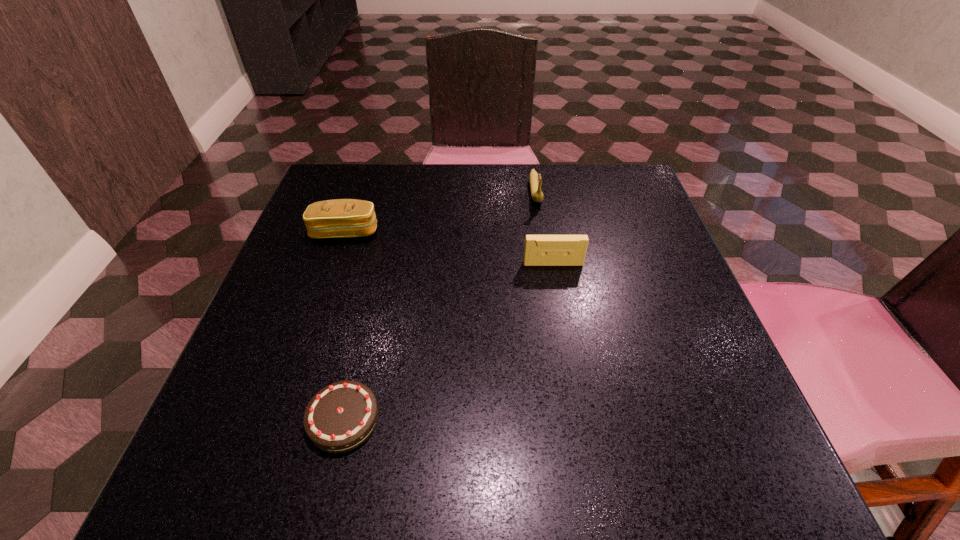
Find the location of a particular element. The height and width of the screenshot is (540, 960). free spot between the clutch bag and the farthest object is located at coordinates (441, 212).

This screenshot has width=960, height=540. I want to click on the third closest object relative to the clutch bag, so click(535, 179).

Identify which object is the third closest to the second farthest object. Please provide its 2D coordinates. Your answer should be formatted as a tuple, i.e. [(x, y)], where the tuple contains the x and y coordinates of a point satisfying the conditions above.

[(535, 179)]

What are the coordinates of `vacant space that satisfies the following two spatial constraints: 1. on the zipper side of the clutch bag; 2. on the right side of the nearest object` in the screenshot? It's located at pos(281,419).

Where is `vacant point that satisfies the following two spatial constraints: 1. on the zipper side of the clutch bag; 2. on the left side of the shortest object`? vacant point that satisfies the following two spatial constraints: 1. on the zipper side of the clutch bag; 2. on the left side of the shortest object is located at coordinates (281, 419).